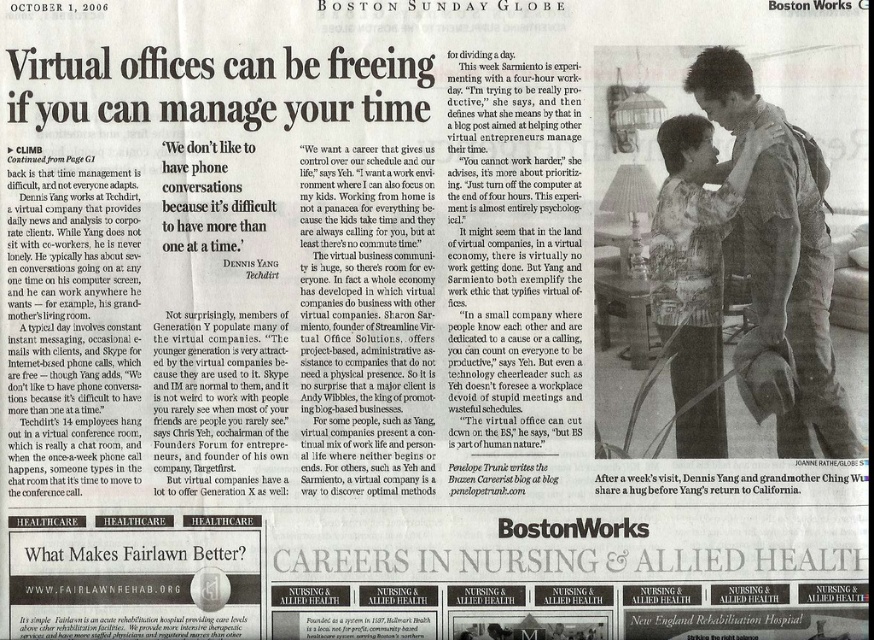
You are a fashion designer looking at the Boston Sunday Globe page. You notice two items at the upper right corner. Which one is nearer to you, the light brown leather jacket at upper right or the light brown textured shirt at upper right?

The light brown leather jacket at upper right is closer to the viewer than the light brown textured shirt at upper right.

What is located at the point with coordinates (796, 294) on the image?

The light brown leather jacket at upper right is located at the point with coordinates (796, 294) on the image.

You are a fashion designer reviewing the Boston Sunday Globe and notice two items on the right side of the page. Which of the two items, the light brown leather jacket at upper right or the light brown textured shirt at upper right, has a greater width?

The light brown leather jacket at upper right has a greater width than the light brown textured shirt at upper right according to the description.